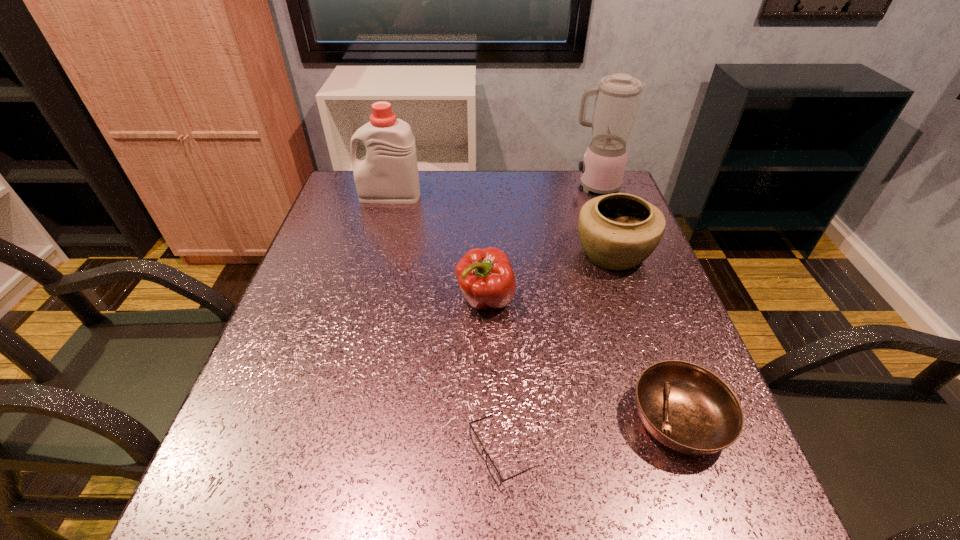
Where is `object that is at the left edge`? The width and height of the screenshot is (960, 540). object that is at the left edge is located at coordinates (388, 174).

Where is `food processor located in the right edge section of the desktop`? food processor located in the right edge section of the desktop is located at coordinates (617, 100).

Identify the location of pottery that is at the right edge. (618, 231).

The image size is (960, 540). I want to click on soup bowl that is at the right edge, so click(686, 407).

Where is `object that is at the far left corner`? The height and width of the screenshot is (540, 960). object that is at the far left corner is located at coordinates (388, 174).

What are the coordinates of `object located in the far right corner section of the desktop` in the screenshot? It's located at (617, 100).

At what (x,y) coordinates should I click in order to perform the action: click on vacant space at the far edge of the desktop. Please return your answer as a coordinate pair (x, y). The image size is (960, 540). Looking at the image, I should click on (456, 170).

Identify the location of free space at the near edge of the desktop. (324, 485).

What are the coordinates of `free space at the left edge of the desktop` in the screenshot? It's located at (306, 404).

The height and width of the screenshot is (540, 960). Find the location of `vacant space at the right edge of the desktop`. vacant space at the right edge of the desktop is located at coordinates (634, 334).